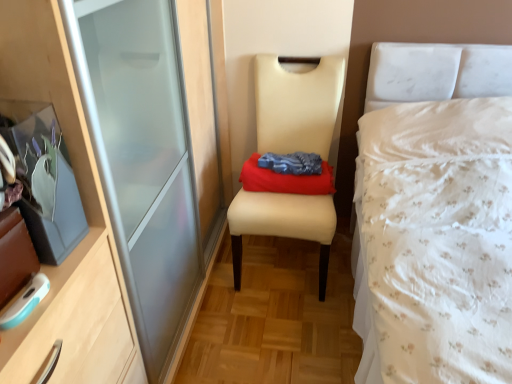
Question: Is beige leather chair at center to the left of white floral fabric bed at right from the viewer's perspective?

Choices:
 (A) yes
 (B) no

Answer: (A)

Question: Does beige leather chair at center lie in front of white floral fabric bed at right?

Choices:
 (A) yes
 (B) no

Answer: (B)

Question: From a real-world perspective, is beige leather chair at center positioned under white floral fabric bed at right based on gravity?

Choices:
 (A) yes
 (B) no

Answer: (A)

Question: Is beige leather chair at center far from white floral fabric bed at right?

Choices:
 (A) no
 (B) yes

Answer: (A)

Question: Does beige leather chair at center have a greater height compared to white floral fabric bed at right?

Choices:
 (A) yes
 (B) no

Answer: (B)

Question: Is beige leather chair at center oriented away from white floral fabric bed at right?

Choices:
 (A) yes
 (B) no

Answer: (B)

Question: From the image's perspective, is red cotton cloth at center on beige leather chair at center?

Choices:
 (A) yes
 (B) no

Answer: (A)

Question: From a real-world perspective, is red cotton cloth at center below beige leather chair at center?

Choices:
 (A) no
 (B) yes

Answer: (A)

Question: Considering the relative sizes of red cotton cloth at center and beige leather chair at center in the image provided, is red cotton cloth at center smaller than beige leather chair at center?

Choices:
 (A) no
 (B) yes

Answer: (B)

Question: Is red cotton cloth at center far away from beige leather chair at center?

Choices:
 (A) yes
 (B) no

Answer: (B)

Question: From a real-world perspective, is red cotton cloth at center physically above beige leather chair at center?

Choices:
 (A) no
 (B) yes

Answer: (B)

Question: Is red cotton cloth at center aimed at beige leather chair at center?

Choices:
 (A) yes
 (B) no

Answer: (A)

Question: From a real-world perspective, is beige leather chair at center physically above red cotton cloth at center?

Choices:
 (A) yes
 (B) no

Answer: (B)